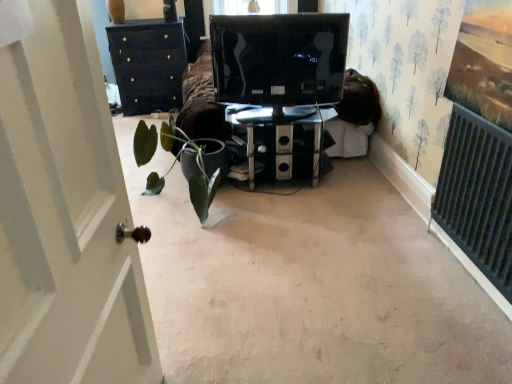
What do you see at coordinates (281, 134) in the screenshot? This screenshot has width=512, height=384. I see `transparent glass table at center` at bounding box center [281, 134].

Find the location of `transparent glass table at center`. transparent glass table at center is located at coordinates (281, 134).

Identify the location of black glossy monitor at center. (279, 59).

From a real-world perspective, between black glossy monitor at center and transparent glass table at center, who is vertically higher?

From a 3D spatial view, black glossy monitor at center is above.

Is black glossy monitor at center aimed at transparent glass table at center?

No.

Does black glossy monitor at center appear on the right side of transparent glass table at center?

No.

Who is shorter, green matte plant at center or transparent glass table at center?

transparent glass table at center is shorter.

Considering the relative positions of green matte plant at center and transparent glass table at center in the image provided, is green matte plant at center to the right of transparent glass table at center from the viewer's perspective?

No.

In the scene shown: From a real-world perspective, who is located higher, green matte plant at center or transparent glass table at center?

green matte plant at center.

How distant is green matte plant at center from transparent glass table at center?

green matte plant at center is 20.38 inches away from transparent glass table at center.

From the image's perspective, is black glossy monitor at center beneath green matte plant at center?

Incorrect, from the image's perspective, black glossy monitor at center is higher than green matte plant at center.

Is black glossy monitor at center oriented towards green matte plant at center?

No, black glossy monitor at center is not aimed at green matte plant at center.

Is black glossy monitor at center with green matte plant at center?

black glossy monitor at center and green matte plant at center are not in contact.

Based on the photo, measure the distance between transparent glass table at center and black glossy monitor at center.

11.08 inches.

Could black glossy monitor at center be considered to be inside transparent glass table at center?

No, black glossy monitor at center is located outside of transparent glass table at center.

From the image's perspective, between transparent glass table at center and black glossy monitor at center, who is located below?

transparent glass table at center appears lower in the image.

Between point (317, 108) and point (275, 116), which one is positioned in front?

Positioned in front is point (275, 116).

Considering the sizes of green matte plant at center and black glossy monitor at center in the image, is green matte plant at center bigger or smaller than black glossy monitor at center?

Considering their sizes, green matte plant at center takes up more space than black glossy monitor at center.

Which is in front, green matte plant at center or black glossy monitor at center?

green matte plant at center is in front.

From the image's perspective, which is below, green matte plant at center or black glossy monitor at center?

green matte plant at center is shown below in the image.

Which is more to the left, green matte plant at center or black glossy monitor at center?

green matte plant at center.

Between transparent glass table at center and green matte plant at center, which one has smaller width?

transparent glass table at center.

Is point (318, 144) positioned after point (136, 146)?

Yes, point (318, 144) is farther from viewer.

From the image's perspective, which object appears higher, transparent glass table at center or green matte plant at center?

transparent glass table at center.

What's the angular difference between transparent glass table at center and green matte plant at center's facing directions?

There is a 1.24e-05-degree angle between the facing directions of transparent glass table at center and green matte plant at center.

The height and width of the screenshot is (384, 512). I want to click on furniture below the black glossy monitor at center (from a real-world perspective), so click(x=281, y=134).

In order to click on houseplant located above the transparent glass table at center (from a real-world perspective) in this screenshot , I will do `click(197, 167)`.

Considering their positions, is green matte plant at center positioned closer to black glossy monitor at center than transparent glass table at center?

Based on the image, transparent glass table at center appears to be nearer to black glossy monitor at center.

Which object lies further to the anchor point transparent glass table at center, black glossy monitor at center or green matte plant at center?

The object further to transparent glass table at center is green matte plant at center.

Looking at the image, which one is located closer to transparent glass table at center, green matte plant at center or black glossy monitor at center?

black glossy monitor at center is positioned closer to the anchor transparent glass table at center.

From the image, which object appears to be nearer to black glossy monitor at center, transparent glass table at center or green matte plant at center?

transparent glass table at center is positioned closer to the anchor black glossy monitor at center.

From the picture: Estimate the real-world distances between objects in this image. Which object is closer to green matte plant at center, black glossy monitor at center or transparent glass table at center?

transparent glass table at center.

Based on their spatial positions, is transparent glass table at center or black glossy monitor at center closer to green matte plant at center?

transparent glass table at center lies closer to green matte plant at center than the other object.

You are a GUI agent. You are given a task and a screenshot of the screen. Output one action in this format:
    pyautogui.click(x=<x>, y=<y>)
    Task: Click on the computer monitor between green matte plant at center and transparent glass table at center in the horizontal direction
    Image resolution: width=512 pixels, height=384 pixels.
    Given the screenshot: What is the action you would take?
    pyautogui.click(x=279, y=59)